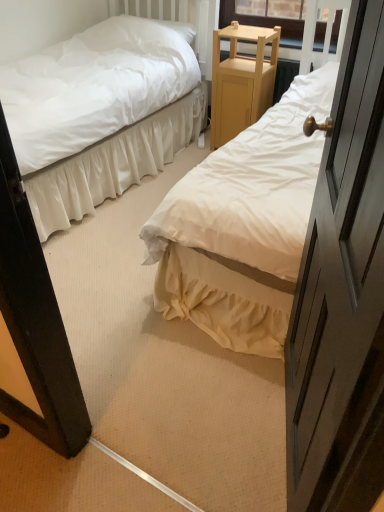
Question: Does white cotton bed at center, arranged as the 1th bed when viewed from the right, lie in front of white satin bed at center, the 2th bed when ordered from right to left?

Choices:
 (A) no
 (B) yes

Answer: (B)

Question: Can you confirm if white cotton bed at center, arranged as the 1th bed when viewed from the right, is bigger than white satin bed at center, the 2th bed when ordered from right to left?

Choices:
 (A) yes
 (B) no

Answer: (B)

Question: Is white cotton bed at center, the 2th bed positioned from the left, smaller than white satin bed at center, the 2th bed when ordered from right to left?

Choices:
 (A) yes
 (B) no

Answer: (A)

Question: Is white cotton bed at center, the 2th bed positioned from the left, taller than white satin bed at center, which is the 1th bed in left-to-right order?

Choices:
 (A) yes
 (B) no

Answer: (A)

Question: Is white cotton bed at center, the 2th bed positioned from the left, looking in the opposite direction of white satin bed at center, the 2th bed when ordered from right to left?

Choices:
 (A) no
 (B) yes

Answer: (A)

Question: Relative to white satin bed at center, which is the 1th bed in left-to-right order, is light wood/finely crafted nightstand at center in front or behind?

Choices:
 (A) front
 (B) behind

Answer: (B)

Question: From a real-world perspective, relative to white satin bed at center, the 2th bed when ordered from right to left, is light wood/finely crafted nightstand at center vertically above or below?

Choices:
 (A) above
 (B) below

Answer: (B)

Question: From the image's perspective, is light wood/finely crafted nightstand at center above or below white satin bed at center, the 2th bed when ordered from right to left?

Choices:
 (A) below
 (B) above

Answer: (B)

Question: In terms of width, does light wood/finely crafted nightstand at center look wider or thinner when compared to white satin bed at center, which is the 1th bed in left-to-right order?

Choices:
 (A) wide
 (B) thin

Answer: (B)

Question: In terms of height, does white cotton bed at center, arranged as the 1th bed when viewed from the right, look taller or shorter compared to white soft pillow at upper left?

Choices:
 (A) tall
 (B) short

Answer: (A)

Question: In terms of width, does white cotton bed at center, the 2th bed positioned from the left, look wider or thinner when compared to white soft pillow at upper left?

Choices:
 (A) thin
 (B) wide

Answer: (B)

Question: Would you say white cotton bed at center, arranged as the 1th bed when viewed from the right, is to the left or to the right of white soft pillow at upper left in the picture?

Choices:
 (A) right
 (B) left

Answer: (A)

Question: From a real-world perspective, is white cotton bed at center, arranged as the 1th bed when viewed from the right, above or below white soft pillow at upper left?

Choices:
 (A) above
 (B) below

Answer: (B)

Question: From a real-world perspective, is white cotton bed at center, arranged as the 1th bed when viewed from the right, above or below white satin bed at center, the 2th bed when ordered from right to left?

Choices:
 (A) below
 (B) above

Answer: (B)

Question: Considering the positions of white cotton bed at center, arranged as the 1th bed when viewed from the right, and white satin bed at center, which is the 1th bed in left-to-right order, in the image, is white cotton bed at center, arranged as the 1th bed when viewed from the right, bigger or smaller than white satin bed at center, which is the 1th bed in left-to-right order,?

Choices:
 (A) big
 (B) small

Answer: (B)